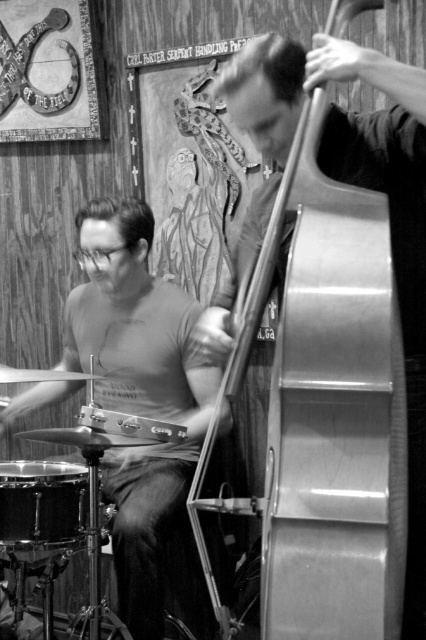
What do you see at coordinates (138, 390) in the screenshot? This screenshot has height=640, width=426. I see `matte black drum set at left` at bounding box center [138, 390].

Does matte black drum set at left appear over metallic silver cello at right?

No.

Is point (149, 470) behind point (241, 355)?

Yes, point (149, 470) is farther from viewer.

The image size is (426, 640). Find the location of `matte black drum set at left`. matte black drum set at left is located at coordinates (138, 390).

Is metallic silver cello at right above black drum at lower left?

Yes, metallic silver cello at right is above black drum at lower left.

Where is `metallic silver cello at right`? metallic silver cello at right is located at coordinates (249, 317).

Identify the location of metallic silver cello at right. Image resolution: width=426 pixels, height=640 pixels. (249, 317).

Is matte black drum set at left to the right of black drum at lower left from the viewer's perspective?

Yes, matte black drum set at left is to the right of black drum at lower left.

Find the location of a particular element. This screenshot has width=426, height=640. matte black drum set at left is located at coordinates (138, 390).

Between point (8, 406) and point (60, 516), which one is positioned behind?

The point (8, 406) is more distant.

Find the location of a particular element. matte black drum set at left is located at coordinates (138, 390).